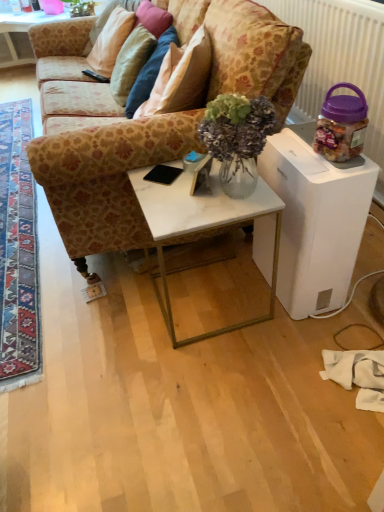
At what (x,y) coordinates should I click in order to perform the action: click on free space to the left of white marble table at center, which ranks as the 2th table in right-to-left order. Please return your answer as a coordinate pair (x, y). The image size is (384, 512). Looking at the image, I should click on (111, 318).